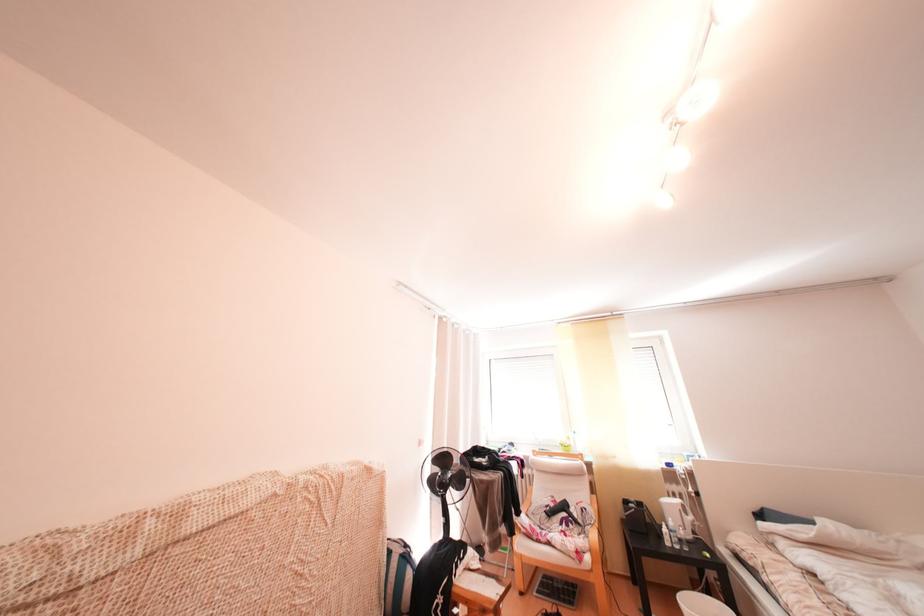
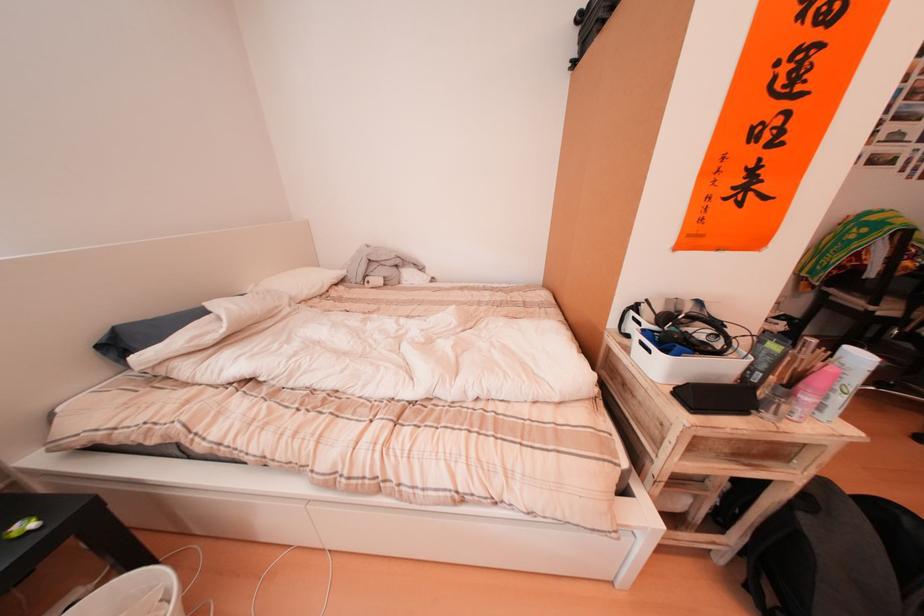
In the second image, find the point that corresponds to (767,513) in the first image.

(105, 339)